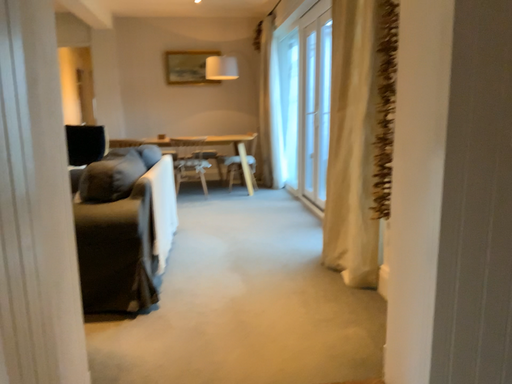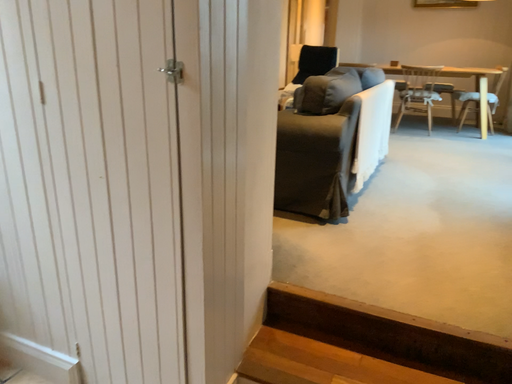
Question: Which way did the camera rotate in the video?

Choices:
 (A) rotated right
 (B) rotated left

Answer: (B)